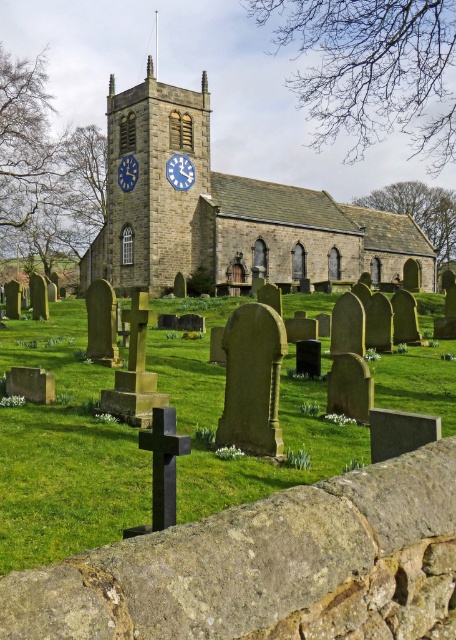
Question: Which of the following is the farthest from the observer?

Choices:
 (A) (186, 173)
 (B) (124, 145)

Answer: (B)

Question: Does green grass at center appear under blue painted wood clock at center?

Choices:
 (A) no
 (B) yes

Answer: (B)

Question: Can you confirm if green grass at center is positioned above stone clock tower at center?

Choices:
 (A) no
 (B) yes

Answer: (A)

Question: Is stone clock tower at center below blue painted wood clock at center?

Choices:
 (A) no
 (B) yes

Answer: (B)

Question: Which point appears farthest from the camera in this image?

Choices:
 (A) (170, 179)
 (B) (268, 470)
 (C) (124, 182)

Answer: (C)

Question: Which of the following is the closest to the observer?

Choices:
 (A) pyautogui.click(x=326, y=467)
 (B) pyautogui.click(x=164, y=214)
 (C) pyautogui.click(x=176, y=180)

Answer: (A)